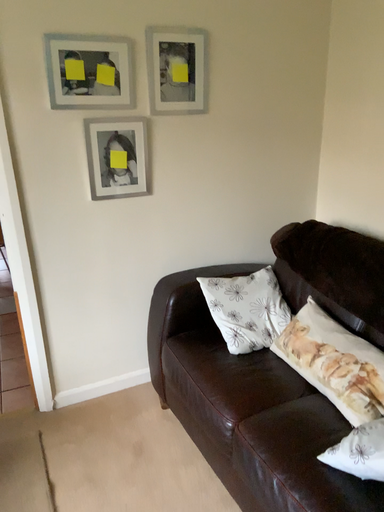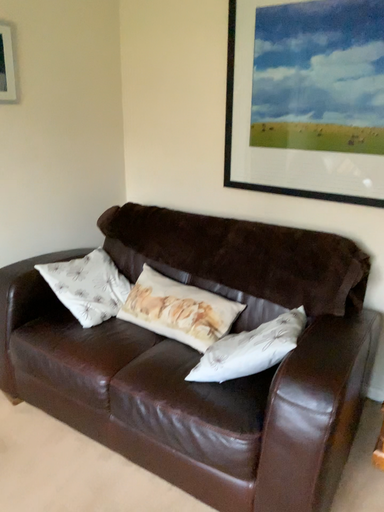
Question: Which way did the camera rotate in the video?

Choices:
 (A) rotated left
 (B) rotated right

Answer: (B)